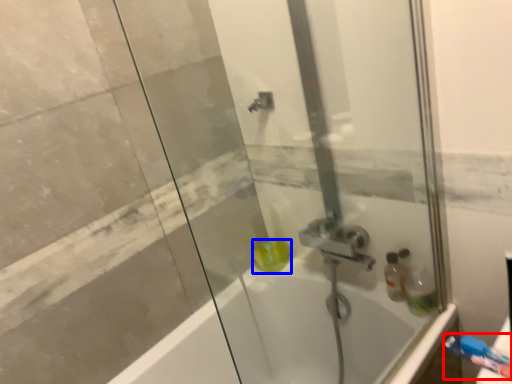
Question: Which object appears farthest to the camera in this image, toiletry (highlighted by a red box) or liquid (highlighted by a blue box)?

Choices:
 (A) toiletry
 (B) liquid

Answer: (B)